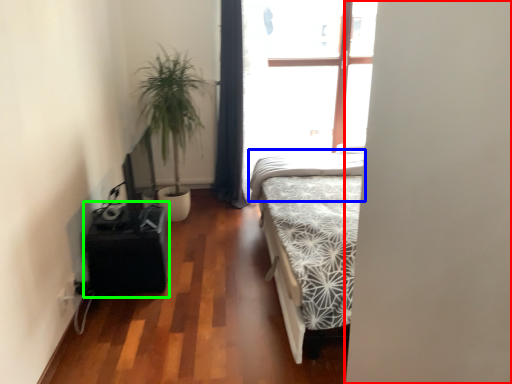
Question: Considering the real-world distances, which object is farthest from screen door (highlighted by a red box)? mattress (highlighted by a blue box) or table (highlighted by a green box)?

Choices:
 (A) mattress
 (B) table

Answer: (A)